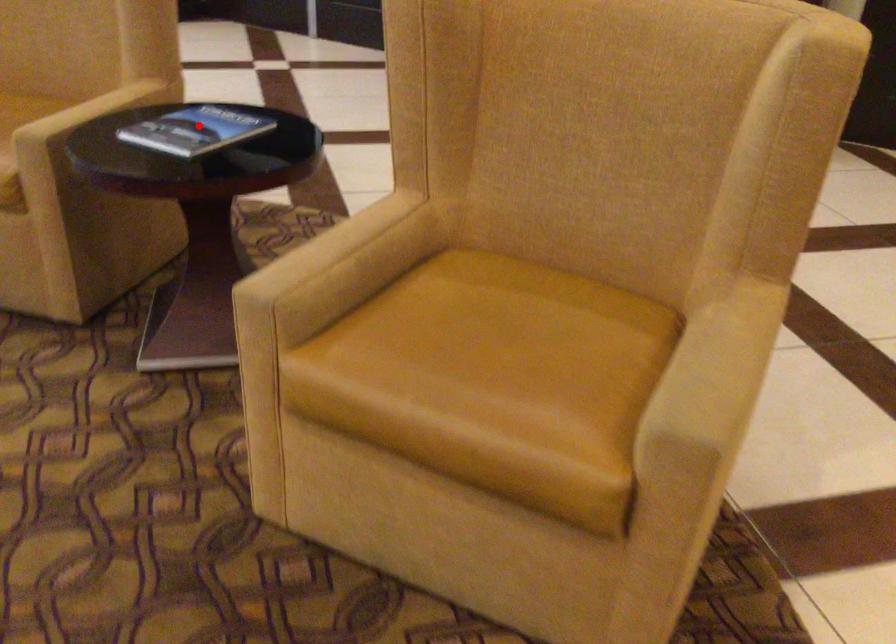
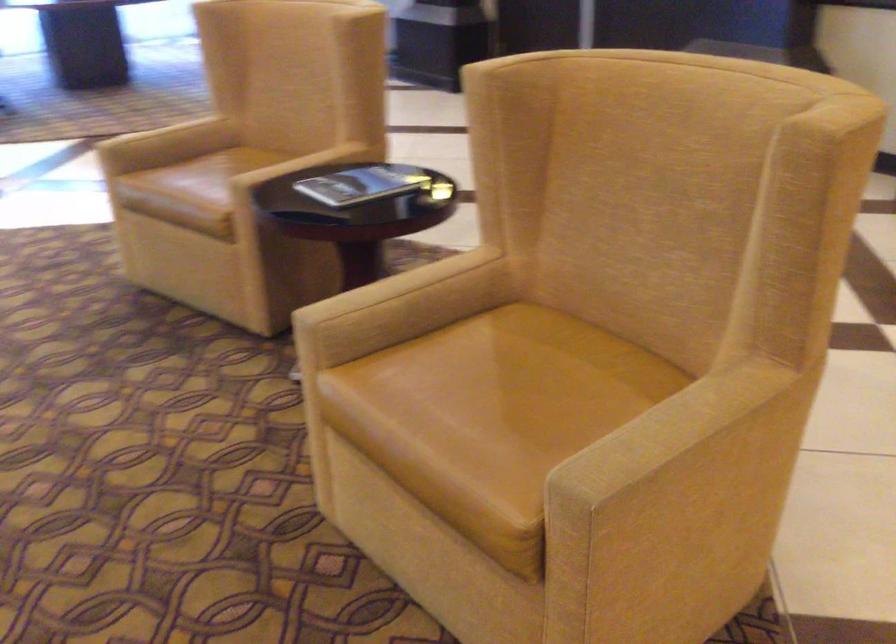
Locate, in the second image, the point that corresponds to the highlighted location in the first image.

(363, 184)